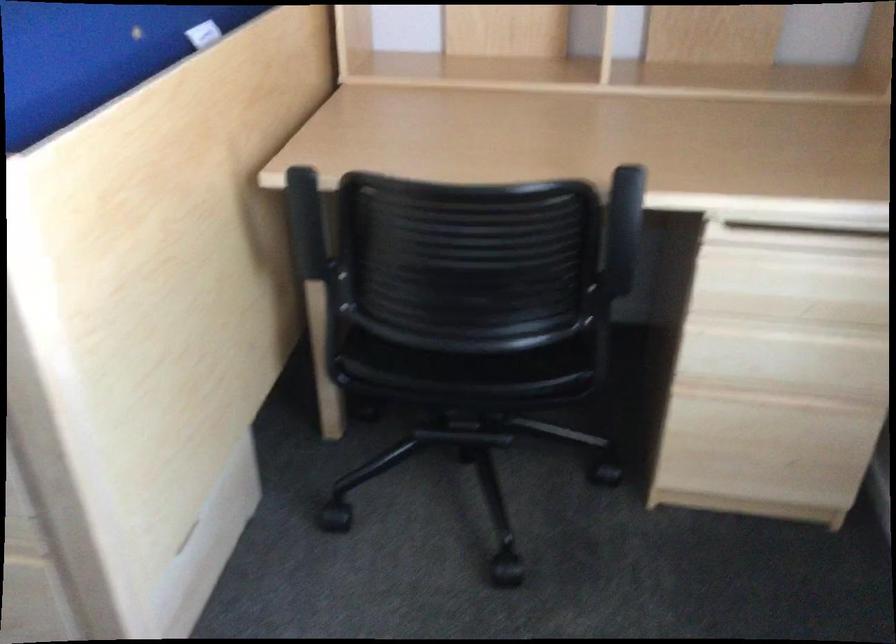
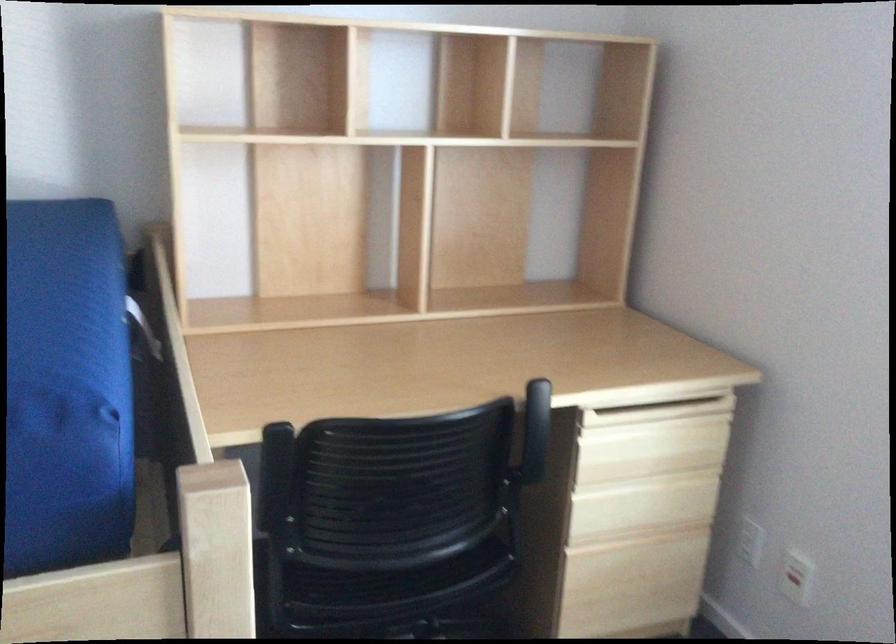
The point at (800, 290) is marked in the first image. Where is the corresponding point in the second image?

(650, 448)